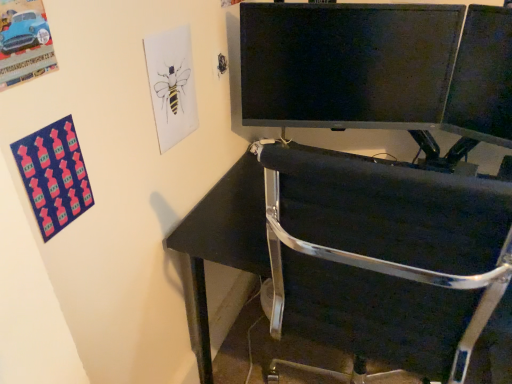
You are a GUI agent. You are given a task and a screenshot of the screen. Output one action in this format:
    pyautogui.click(x=<x>, y=<y>)
    Task: Click on the black glossy monitor at upper center
    The image size is (512, 384).
    Given the screenshot: What is the action you would take?
    pyautogui.click(x=346, y=64)

Where is `television that is on the left side of matte black monitor at upper right`? The image size is (512, 384). television that is on the left side of matte black monitor at upper right is located at coordinates (346, 64).

Can you confirm if black glossy monitor at upper center is thinner than matte black monitor at upper right?

Yes, black glossy monitor at upper center is thinner than matte black monitor at upper right.

From a real-world perspective, between black glossy monitor at upper center and matte black monitor at upper right, who is vertically higher?

black glossy monitor at upper center is physically above.

Which is more to the left, black glossy monitor at upper center or matte black monitor at upper right?

Positioned to the left is black glossy monitor at upper center.

How different are the orientations of black metal chair at lower right and black glossy monitor at upper center in degrees?

The angle between the facing direction of black metal chair at lower right and the facing direction of black glossy monitor at upper center is 17.1 degrees.

Does black metal chair at lower right have a larger size compared to black glossy monitor at upper center?

Yes.

Which is more to the right, black metal chair at lower right or black glossy monitor at upper center?

black metal chair at lower right is more to the right.

Can you see matte black monitor at upper right touching black glossy monitor at upper center?

No, matte black monitor at upper right is not in contact with black glossy monitor at upper center.

In the scene shown: Which object is further away from the camera, matte black monitor at upper right or black glossy monitor at upper center?

black glossy monitor at upper center is further from the camera.

Does matte black monitor at upper right appear on the left side of black glossy monitor at upper center?

In fact, matte black monitor at upper right is to the right of black glossy monitor at upper center.

Which object is thinner, matte black monitor at upper right or black glossy monitor at upper center?

With smaller width is black glossy monitor at upper center.

From the picture: How far apart are black glossy monitor at upper center and black metal chair at lower right?

The distance of black glossy monitor at upper center from black metal chair at lower right is 28.05 inches.

How different are the orientations of black glossy monitor at upper center and black metal chair at lower right in degrees?

They differ by 17.1 degrees in their facing directions.

Is black metal chair at lower right surrounded by black glossy monitor at upper center?

No, black metal chair at lower right is not inside black glossy monitor at upper center.

Considering their positions, is black glossy monitor at upper center located in front of or behind black metal chair at lower right?

black glossy monitor at upper center is behind black metal chair at lower right.

In terms of width, does black metal chair at lower right look wider or thinner when compared to matte black monitor at upper right?

black metal chair at lower right is wider than matte black monitor at upper right.

Can you confirm if black metal chair at lower right is bigger than matte black monitor at upper right?

Indeed, black metal chair at lower right has a larger size compared to matte black monitor at upper right.

Does black metal chair at lower right have a lesser height compared to matte black monitor at upper right?

In fact, black metal chair at lower right may be taller than matte black monitor at upper right.

In the scene shown: Considering the positions of objects matte black monitor at upper right and black metal chair at lower right in the image provided, who is more to the right, matte black monitor at upper right or black metal chair at lower right?

matte black monitor at upper right.

From the image's perspective, does matte black monitor at upper right appear higher than black metal chair at lower right?

Yes.

Can you confirm if matte black monitor at upper right is smaller than black metal chair at lower right?

Correct, matte black monitor at upper right occupies less space than black metal chair at lower right.

Does matte black monitor at upper right turn towards black metal chair at lower right?

No, matte black monitor at upper right is not turned towards black metal chair at lower right.

Locate an element on the screen. computer monitor on the right of black glossy monitor at upper center is located at coordinates (482, 78).

Find the location of a particular element. television on the left of black metal chair at lower right is located at coordinates (346, 64).

From the image, which object appears to be nearer to black glossy monitor at upper center, matte black monitor at upper right or black metal chair at lower right?

Based on the image, matte black monitor at upper right appears to be nearer to black glossy monitor at upper center.

When comparing their distances from black metal chair at lower right, does matte black monitor at upper right or black glossy monitor at upper center seem closer?

black glossy monitor at upper center lies closer to black metal chair at lower right than the other object.

When comparing their distances from black metal chair at lower right, does black glossy monitor at upper center or matte black monitor at upper right seem closer?

black glossy monitor at upper center is positioned closer to the anchor black metal chair at lower right.

Looking at the image, which one is located closer to matte black monitor at upper right, black glossy monitor at upper center or black metal chair at lower right?

black glossy monitor at upper center lies closer to matte black monitor at upper right than the other object.

Looking at the image, which one is located closer to matte black monitor at upper right, black metal chair at lower right or black glossy monitor at upper center?

black glossy monitor at upper center is closer to matte black monitor at upper right.

Looking at the image, which one is located further to black glossy monitor at upper center, black metal chair at lower right or matte black monitor at upper right?

black metal chair at lower right lies further to black glossy monitor at upper center than the other object.

This screenshot has width=512, height=384. Find the location of `computer monitor that lies between black glossy monitor at upper center and black metal chair at lower right from top to bottom`. computer monitor that lies between black glossy monitor at upper center and black metal chair at lower right from top to bottom is located at coordinates (482, 78).